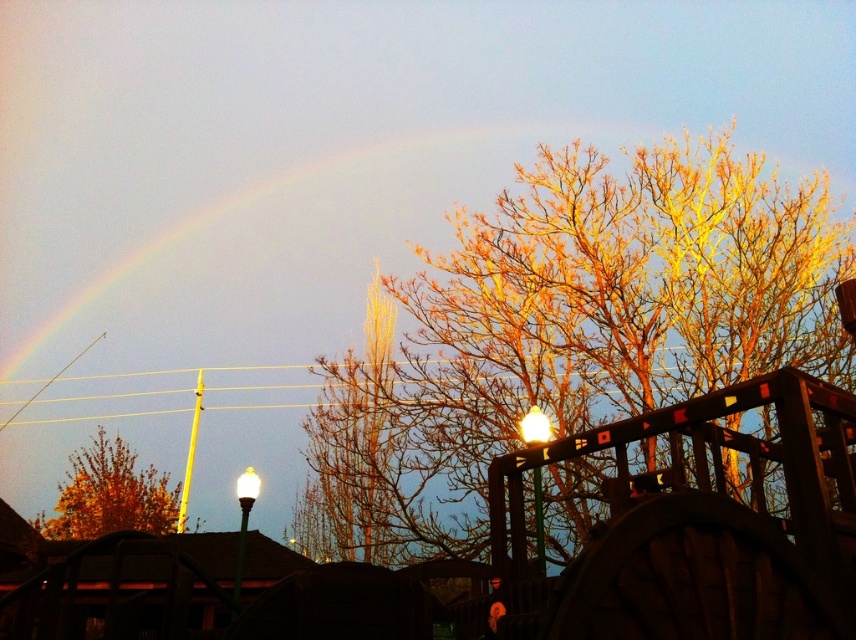
Can you confirm if orange-brown textured tree at upper center is positioned above golden leafy tree at lower left?

Indeed, orange-brown textured tree at upper center is positioned over golden leafy tree at lower left.

Does point (675, 332) come in front of point (110, 492)?

Yes, point (675, 332) is in front of point (110, 492).

Locate an element on the screen. orange-brown textured tree at upper center is located at coordinates click(574, 330).

Between point (308, 547) and point (289, 310), which one is positioned behind?

The point (289, 310) is behind.

Between orange-brown textured tree at upper center and rainbow at upper left, which one appears on the right side from the viewer's perspective?

From the viewer's perspective, orange-brown textured tree at upper center appears more on the right side.

Which is in front, point (465, 470) or point (450, 128)?

Point (465, 470) is more forward.

Where is `orange-brown textured tree at upper center`? The image size is (856, 640). orange-brown textured tree at upper center is located at coordinates (574, 330).

Does rainbow at upper left have a greater height compared to golden leafy tree at lower left?

Indeed, rainbow at upper left has a greater height compared to golden leafy tree at lower left.

Is point (277, 305) positioned before point (96, 492)?

Yes, it is.

Between point (155, 284) and point (78, 529), which one is positioned in front?

Point (155, 284) is in front.

Where is `rainbow at upper left`? The width and height of the screenshot is (856, 640). rainbow at upper left is located at coordinates (269, 257).